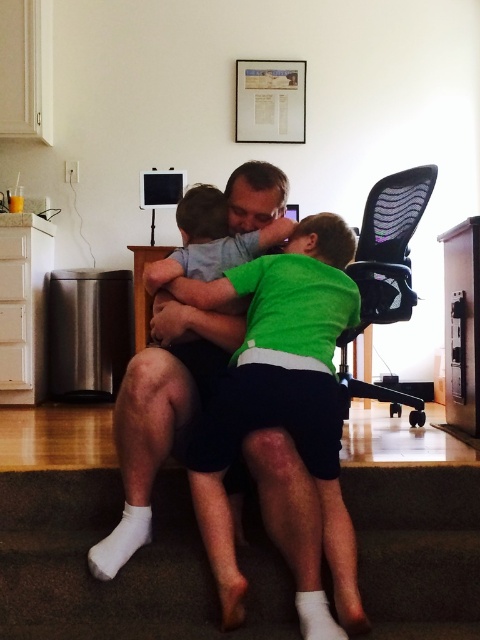
Can you confirm if smooth skin man at center is shorter than black mesh swivel chair at right?

Correct, smooth skin man at center is not as tall as black mesh swivel chair at right.

Is smooth skin man at center thinner than black mesh swivel chair at right?

No.

Who is more forward, (151, 454) or (400, 198)?

Point (151, 454)

Where is `smooth skin man at center`? Image resolution: width=480 pixels, height=640 pixels. smooth skin man at center is located at coordinates (160, 412).